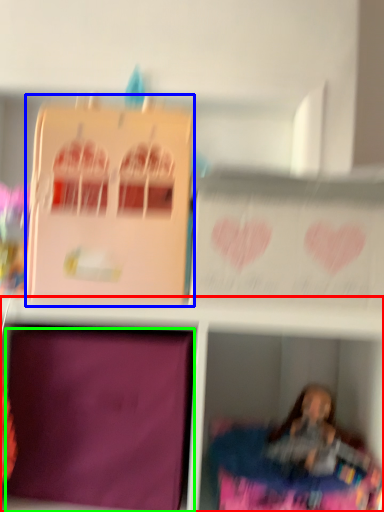
Question: Estimate the real-world distances between objects in this image. Which object is closer to shelf (highlighted by a red box), cardboard box (highlighted by a blue box) or cardboard box (highlighted by a green box)?

Choices:
 (A) cardboard box
 (B) cardboard box

Answer: (B)